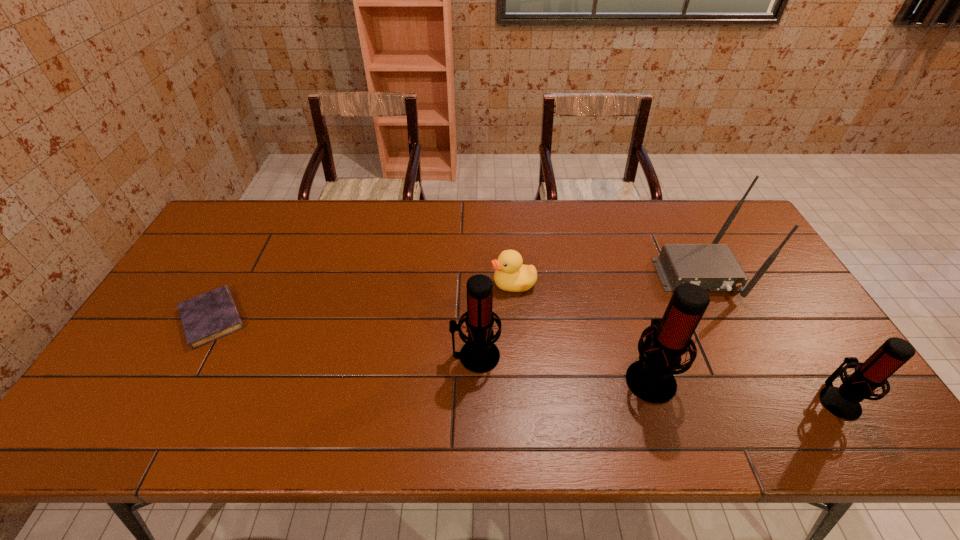
This screenshot has width=960, height=540. Identify the location of free space that satisfies the following two spatial constraints: 1. at the beak of the duck; 2. on the left side of the second microphone from right to left. (520, 377).

Locate an element on the screen. The width and height of the screenshot is (960, 540). vacant position in the image that satisfies the following two spatial constraints: 1. on the back of the fourth tallest object to connect cables; 2. on the right side of the router is located at coordinates (760, 400).

You are a GUI agent. You are given a task and a screenshot of the screen. Output one action in this format:
    pyautogui.click(x=<x>, y=<y>)
    Task: Click on the blank space that satisfies the following two spatial constraints: 1. on the back of the router to connect cables; 2. at the beak of the duck
    Image resolution: width=960 pixels, height=540 pixels.
    Given the screenshot: What is the action you would take?
    pyautogui.click(x=703, y=284)

Where is `free space that satisfies the following two spatial constraints: 1. at the beak of the duck; 2. on the back side of the shortest microphone`? free space that satisfies the following two spatial constraints: 1. at the beak of the duck; 2. on the back side of the shortest microphone is located at coordinates (522, 400).